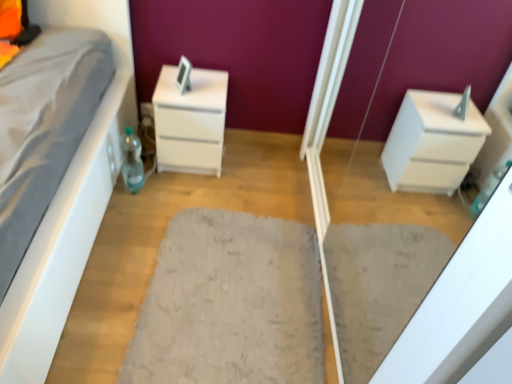
Where is `white glossy drawer at right`? Image resolution: width=512 pixels, height=384 pixels. white glossy drawer at right is located at coordinates (323, 142).

Is the surface of white glossy chest of drawers at center in direct contact with white glossy drawer at right?

There is a gap between white glossy chest of drawers at center and white glossy drawer at right.

Considering the positions of points (189, 163) and (342, 72), is point (189, 163) farther from camera compared to point (342, 72)?

Yes, it is behind point (342, 72).

Relative to white glossy drawer at right, is white glossy chest of drawers at center in front or behind?

Clearly, white glossy chest of drawers at center is behind white glossy drawer at right.

I want to click on chest of drawers below the white glossy drawer at right (from a real-world perspective), so click(190, 121).

Is white glossy chest of drawers at center at the left side of translucent plastic bottle at lower left?

No.

Is point (187, 166) closer to camera compared to point (130, 135)?

No, (187, 166) is further to viewer.

Find the location of a particular element. bottle beneath the white glossy chest of drawers at center (from a real-world perspective) is located at coordinates (132, 161).

From a real-world perspective, is white glossy chest of drawers at center over translucent plastic bottle at lower left?

Indeed, from a real-world perspective, white glossy chest of drawers at center stands above translucent plastic bottle at lower left.

Would you say white glossy chest of drawers at center is a long distance from gray fluffy rug at center?

white glossy chest of drawers at center is actually quite close to gray fluffy rug at center.

Is white glossy chest of drawers at center inside or outside of gray fluffy rug at center?

white glossy chest of drawers at center is outside gray fluffy rug at center.

From the image's perspective, which one is positioned higher, white glossy drawer at right or translucent plastic bottle at lower left?

translucent plastic bottle at lower left appears higher in the image.

Which is correct: white glossy drawer at right is inside translucent plastic bottle at lower left, or outside of it?

white glossy drawer at right lies outside translucent plastic bottle at lower left.

Can you confirm if white glossy drawer at right is taller than translucent plastic bottle at lower left?

Yes.

Which object is further away from the camera, white glossy drawer at right or translucent plastic bottle at lower left?

translucent plastic bottle at lower left is more distant.

Is point (244, 339) less distant than point (126, 165)?

Yes.

How many degrees apart are the facing directions of gray fluffy rug at center and translucent plastic bottle at lower left?

The angle between the facing direction of gray fluffy rug at center and the facing direction of translucent plastic bottle at lower left is 113 degrees.

From a real-world perspective, is gray fluffy rug at center beneath translucent plastic bottle at lower left?

Yes, from a real-world perspective, gray fluffy rug at center is under translucent plastic bottle at lower left.

How different are the orientations of gray fluffy rug at center and white glossy drawer at right in degrees?

The angular difference between gray fluffy rug at center and white glossy drawer at right is 4.68 degrees.

Considering the relative positions of gray fluffy rug at center and white glossy drawer at right in the image provided, is gray fluffy rug at center to the left of white glossy drawer at right from the viewer's perspective?

Yes, gray fluffy rug at center is to the left of white glossy drawer at right.

Can white glossy drawer at right be found inside gray fluffy rug at center?

No, white glossy drawer at right is not surrounded by gray fluffy rug at center.

Is gray fluffy rug at center not close to white glossy drawer at right?

No.

Can you confirm if translucent plastic bottle at lower left is shorter than white glossy chest of drawers at center?

Indeed, translucent plastic bottle at lower left has a lesser height compared to white glossy chest of drawers at center.

From a real-world perspective, is translucent plastic bottle at lower left positioned under white glossy chest of drawers at center based on gravity?

Yes, from a real-world perspective, translucent plastic bottle at lower left is under white glossy chest of drawers at center.

Between translucent plastic bottle at lower left and white glossy chest of drawers at center, which one has larger size?

With larger size is white glossy chest of drawers at center.

Locate an element on the screen. screen door located in front of the white glossy chest of drawers at center is located at coordinates (323, 142).

This screenshot has width=512, height=384. In order to click on the chest of drawers behind the translucent plastic bottle at lower left in this screenshot , I will do `click(190, 121)`.

Looking at the image, which one is located closer to white glossy chest of drawers at center, translucent plastic bottle at lower left or white glossy drawer at right?

translucent plastic bottle at lower left is positioned closer to the anchor white glossy chest of drawers at center.

Estimate the real-world distances between objects in this image. Which object is closer to white glossy drawer at right, gray fluffy rug at center or translucent plastic bottle at lower left?

Based on the image, gray fluffy rug at center appears to be nearer to white glossy drawer at right.

Looking at the image, which one is located further to white glossy chest of drawers at center, gray fluffy rug at center or white glossy drawer at right?

white glossy drawer at right.

When comparing their distances from translucent plastic bottle at lower left, does gray fluffy rug at center or white glossy drawer at right seem closer?

gray fluffy rug at center is positioned closer to the anchor translucent plastic bottle at lower left.

Based on their spatial positions, is white glossy drawer at right or gray fluffy rug at center further from translucent plastic bottle at lower left?

white glossy drawer at right is positioned further to the anchor translucent plastic bottle at lower left.

Which object lies further to the anchor point white glossy drawer at right, white glossy chest of drawers at center or gray fluffy rug at center?

Among the two, white glossy chest of drawers at center is located further to white glossy drawer at right.

From the image, which object appears to be nearer to translucent plastic bottle at lower left, gray fluffy rug at center or white glossy chest of drawers at center?

white glossy chest of drawers at center lies closer to translucent plastic bottle at lower left than the other object.

Consider the image. From the image, which object appears to be nearer to gray fluffy rug at center, translucent plastic bottle at lower left or white glossy chest of drawers at center?

The object closer to gray fluffy rug at center is white glossy chest of drawers at center.

Image resolution: width=512 pixels, height=384 pixels. In order to click on doormat between white glossy drawer at right and translucent plastic bottle at lower left in the front-back direction in this screenshot , I will do `click(230, 304)`.

Locate an element on the screen. Image resolution: width=512 pixels, height=384 pixels. bottle between white glossy drawer at right and white glossy chest of drawers at center in the front-back direction is located at coordinates (132, 161).

Locate an element on the screen. bottle between white glossy chest of drawers at center and gray fluffy rug at center in the vertical direction is located at coordinates (132, 161).

Locate an element on the screen. The width and height of the screenshot is (512, 384). doormat between white glossy drawer at right and white glossy chest of drawers at center from front to back is located at coordinates (230, 304).